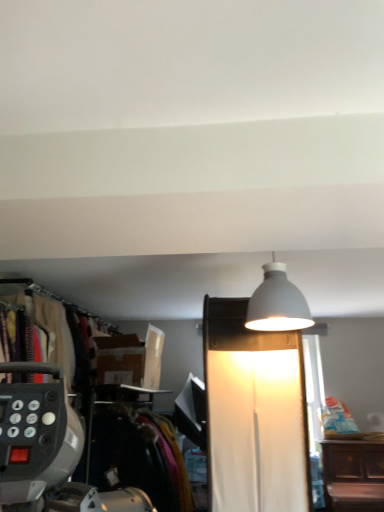
Find the location of a particular element. This screenshot has height=512, width=384. velvet-like fabric at left is located at coordinates (139, 457).

Describe the element at coordinates (48, 449) in the screenshot. The height and width of the screenshot is (512, 384). I see `black fabric closet at left` at that location.

At what (x,y) coordinates should I click in order to perform the action: click on black fabric closet at left. Please return your answer as a coordinate pair (x, y). Looking at the image, I should click on point(48,449).

Where is `velvet-like fabric at left`? The height and width of the screenshot is (512, 384). velvet-like fabric at left is located at coordinates (139, 457).

Considering the relative positions of white matte lamp at upper center, the 1th lamp from the bottom, and white matte lampshade at upper center, positioned as the first lamp in top-to-bottom order, in the image provided, is white matte lamp at upper center, the 1th lamp from the bottom, to the right of white matte lampshade at upper center, positioned as the first lamp in top-to-bottom order, from the viewer's perspective?

No, white matte lamp at upper center, the 1th lamp from the bottom, is not to the right of white matte lampshade at upper center, positioned as the first lamp in top-to-bottom order.

Which is correct: white matte lamp at upper center, the second lamp when ordered from top to bottom, is inside white matte lampshade at upper center, marked as the second lamp in a bottom-to-top arrangement, or outside of it?

The correct answer is: outside.

From a real-world perspective, is white matte lamp at upper center, the 1th lamp from the bottom, positioned above or below white matte lampshade at upper center, marked as the second lamp in a bottom-to-top arrangement?

white matte lamp at upper center, the 1th lamp from the bottom, is below white matte lampshade at upper center, marked as the second lamp in a bottom-to-top arrangement.

From the image's perspective, which one is positioned higher, velvet-like fabric at left or white matte lampshade at upper center, marked as the second lamp in a bottom-to-top arrangement?

From the image's view, white matte lampshade at upper center, marked as the second lamp in a bottom-to-top arrangement, is above.

Based on the photo, which point is more forward, (112, 446) or (273, 289)?

The point (273, 289) is closer.

Does velvet-like fabric at left have a lesser width compared to white matte lampshade at upper center, marked as the second lamp in a bottom-to-top arrangement?

No, velvet-like fabric at left is not thinner than white matte lampshade at upper center, marked as the second lamp in a bottom-to-top arrangement.

Which point is more distant from viewer, (213, 393) or (140, 426)?

The point (140, 426) is farther.

From a real-world perspective, is white matte lamp at upper center, the 1th lamp from the bottom, positioned above or below velvet-like fabric at left?

In terms of real-world spatial position, white matte lamp at upper center, the 1th lamp from the bottom, is above velvet-like fabric at left.

From a real-world perspective, who is located higher, black fabric closet at left or white matte lamp at upper center, the 1th lamp from the bottom?

From a 3D spatial view, black fabric closet at left is above.

What's the angular difference between black fabric closet at left and white matte lamp at upper center, the second lamp when ordered from top to bottom,'s facing directions?

There is a 90.5-degree angle between the facing directions of black fabric closet at left and white matte lamp at upper center, the second lamp when ordered from top to bottom.

Does black fabric closet at left have a lesser width compared to white matte lamp at upper center, the second lamp when ordered from top to bottom?

Correct, the width of black fabric closet at left is less than that of white matte lamp at upper center, the second lamp when ordered from top to bottom.

Which is more to the right, black fabric closet at left or white matte lamp at upper center, the second lamp when ordered from top to bottom?

Positioned to the right is white matte lamp at upper center, the second lamp when ordered from top to bottom.

Is velvet-like fabric at left further to the viewer compared to black fabric closet at left?

No, it is not.

Would you say velvet-like fabric at left is inside or outside black fabric closet at left?

velvet-like fabric at left is outside black fabric closet at left.

Does velvet-like fabric at left turn towards black fabric closet at left?

No, velvet-like fabric at left does not turn towards black fabric closet at left.

Between point (179, 505) and point (38, 443), which one is positioned behind?

Point (179, 505)

Between white matte lamp at upper center, the second lamp when ordered from top to bottom, and black fabric closet at left, which one has larger size?

Bigger between the two is white matte lamp at upper center, the second lamp when ordered from top to bottom.

Which object is more forward, white matte lamp at upper center, the 1th lamp from the bottom, or black fabric closet at left?

white matte lamp at upper center, the 1th lamp from the bottom, is in front.

Is white matte lamp at upper center, the second lamp when ordered from top to bottom, positioned far away from black fabric closet at left?

Indeed, white matte lamp at upper center, the second lamp when ordered from top to bottom, is not near black fabric closet at left.

Based on the photo, visually, is white matte lamp at upper center, the 1th lamp from the bottom, positioned to the left or to the right of black fabric closet at left?

white matte lamp at upper center, the 1th lamp from the bottom, is positioned on black fabric closet at left's right side.

Would you say black fabric closet at left is outside white matte lampshade at upper center, positioned as the first lamp in top-to-bottom order?

Yes, black fabric closet at left is not within white matte lampshade at upper center, positioned as the first lamp in top-to-bottom order.

How many degrees apart are the facing directions of black fabric closet at left and white matte lampshade at upper center, positioned as the first lamp in top-to-bottom order?

black fabric closet at left and white matte lampshade at upper center, positioned as the first lamp in top-to-bottom order, are facing 94.4 degrees away from each other.

Is black fabric closet at left taller than white matte lampshade at upper center, marked as the second lamp in a bottom-to-top arrangement?

Yes, black fabric closet at left is taller than white matte lampshade at upper center, marked as the second lamp in a bottom-to-top arrangement.

Are black fabric closet at left and white matte lampshade at upper center, marked as the second lamp in a bottom-to-top arrangement, located far from each other?

Yes, black fabric closet at left and white matte lampshade at upper center, marked as the second lamp in a bottom-to-top arrangement, are quite far apart.

The image size is (384, 512). I want to click on lamp that is under the white matte lampshade at upper center, marked as the second lamp in a bottom-to-top arrangement (from a real-world perspective), so click(254, 413).

Find the location of `the 2nd lamp counting from the right side of the velvet-like fabric at left`. the 2nd lamp counting from the right side of the velvet-like fabric at left is located at coordinates (277, 303).

Looking at the image, which one is located further to white matte lamp at upper center, the 1th lamp from the bottom, white matte lampshade at upper center, marked as the second lamp in a bottom-to-top arrangement, or black fabric closet at left?

A: black fabric closet at left lies further to white matte lamp at upper center, the 1th lamp from the bottom, than the other object.

Based on the photo, which object lies nearer to the anchor point velvet-like fabric at left, white matte lamp at upper center, the 1th lamp from the bottom, or black fabric closet at left?

black fabric closet at left is positioned closer to the anchor velvet-like fabric at left.

Based on their spatial positions, is black fabric closet at left or white matte lampshade at upper center, marked as the second lamp in a bottom-to-top arrangement, closer to velvet-like fabric at left?

black fabric closet at left is positioned closer to the anchor velvet-like fabric at left.

From the image, which object appears to be farther from black fabric closet at left, white matte lamp at upper center, the 1th lamp from the bottom, or white matte lampshade at upper center, marked as the second lamp in a bottom-to-top arrangement?

white matte lampshade at upper center, marked as the second lamp in a bottom-to-top arrangement, is positioned further to the anchor black fabric closet at left.

Looking at this image, when comparing their distances from velvet-like fabric at left, does black fabric closet at left or white matte lamp at upper center, the 1th lamp from the bottom, seem closer?

black fabric closet at left lies closer to velvet-like fabric at left than the other object.

From the image, which object appears to be farther from white matte lampshade at upper center, marked as the second lamp in a bottom-to-top arrangement, white matte lamp at upper center, the 1th lamp from the bottom, or black fabric closet at left?

black fabric closet at left is further to white matte lampshade at upper center, marked as the second lamp in a bottom-to-top arrangement.

From the picture: Based on their spatial positions, is velvet-like fabric at left or white matte lampshade at upper center, positioned as the first lamp in top-to-bottom order, further from white matte lamp at upper center, the second lamp when ordered from top to bottom?

velvet-like fabric at left lies further to white matte lamp at upper center, the second lamp when ordered from top to bottom, than the other object.

From the image, which object appears to be nearer to black fabric closet at left, velvet-like fabric at left or white matte lamp at upper center, the 1th lamp from the bottom?

velvet-like fabric at left.

At what (x,y) coordinates should I click in order to perform the action: click on lamp between white matte lampshade at upper center, positioned as the first lamp in top-to-bottom order, and velvet-like fabric at left in the up-down direction. Please return your answer as a coordinate pair (x, y). The image size is (384, 512). Looking at the image, I should click on (254, 413).

Identify the location of clothing between black fabric closet at left and white matte lamp at upper center, the second lamp when ordered from top to bottom, in the horizontal direction. (139, 457).

The height and width of the screenshot is (512, 384). What are the coordinates of `closet between white matte lampshade at upper center, marked as the second lamp in a bottom-to-top arrangement, and velvet-like fabric at left in the up-down direction` in the screenshot? It's located at (48, 449).

At what (x,y) coordinates should I click in order to perform the action: click on lamp located between black fabric closet at left and white matte lampshade at upper center, marked as the second lamp in a bottom-to-top arrangement, in the left-right direction. Please return your answer as a coordinate pair (x, y). Looking at the image, I should click on (254, 413).